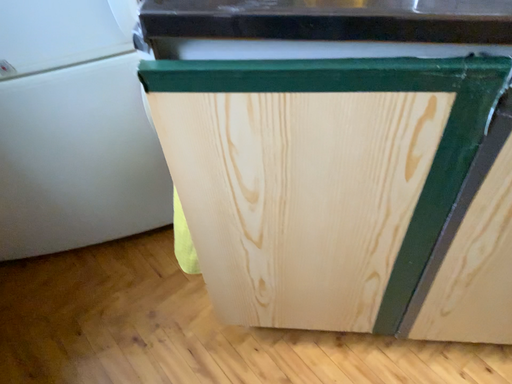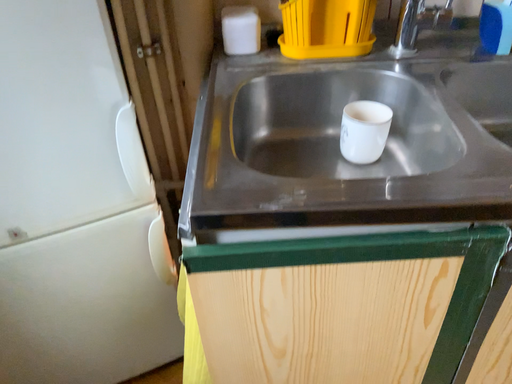
Question: How did the camera likely rotate when shooting the video?

Choices:
 (A) rotated downward
 (B) rotated upward

Answer: (B)